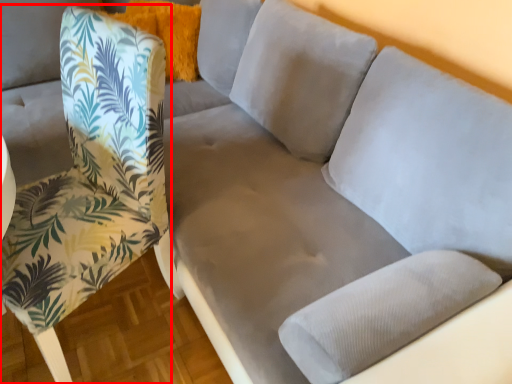
Question: In this image, where is chair (annotated by the red box) located relative to pillow?

Choices:
 (A) right
 (B) left

Answer: (B)